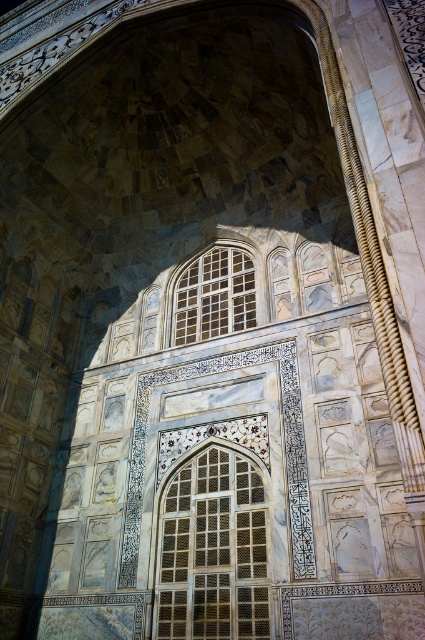
Question: Where is matte glass window at center located in relation to translucent glass window at center in the image?

Choices:
 (A) below
 (B) above

Answer: (A)

Question: Which point is closer to the camera?

Choices:
 (A) (169, 557)
 (B) (206, 307)

Answer: (A)

Question: Does matte glass window at center lie in front of translucent glass window at center?

Choices:
 (A) no
 (B) yes

Answer: (B)

Question: Which of the following is the closest to the observer?

Choices:
 (A) translucent glass window at center
 (B) matte glass window at center

Answer: (B)

Question: Can you confirm if matte glass window at center is thinner than translucent glass window at center?

Choices:
 (A) no
 (B) yes

Answer: (B)

Question: Which object appears farthest from the camera in this image?

Choices:
 (A) translucent glass window at center
 (B) matte glass window at center

Answer: (A)